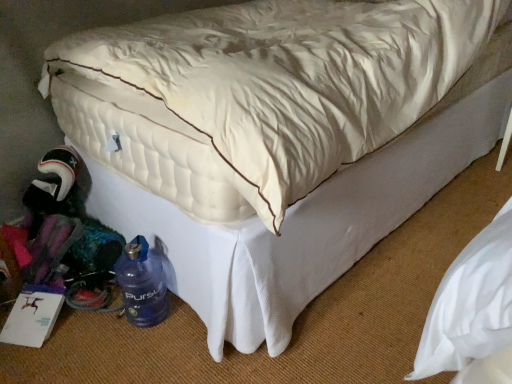
Locate an element on the screen. free space to the right of blue translucent water bottle at lower left is located at coordinates (184, 319).